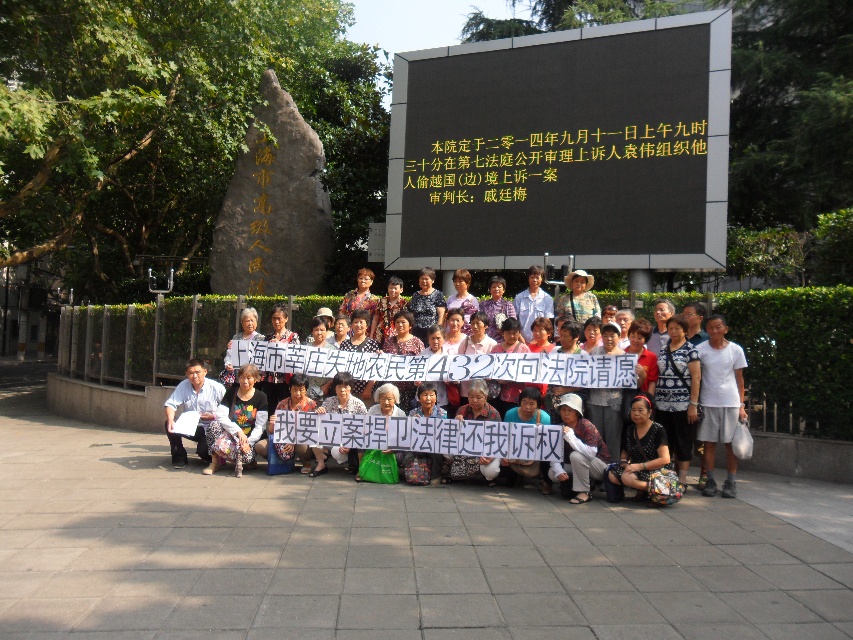
Question: Estimate the real-world distances between objects in this image. Which object is closer to the yellow text at upper center?

Choices:
 (A) white cotton shirt at center
 (B) black matte sign at upper center

Answer: (B)

Question: Can you confirm if black matte sign at upper center is wider than yellow text at upper center?

Choices:
 (A) no
 (B) yes

Answer: (B)

Question: Among these points, which one is nearest to the camera?

Choices:
 (A) (486, 163)
 (B) (553, 358)

Answer: (B)

Question: Which point is farther to the camera?

Choices:
 (A) white cotton shirt at center
 (B) yellow text at upper center
 (C) black matte sign at upper center

Answer: (B)

Question: Does black matte sign at upper center have a smaller size compared to yellow text at upper center?

Choices:
 (A) no
 (B) yes

Answer: (A)

Question: Can you confirm if black matte sign at upper center is positioned to the right of white cotton shirt at center?

Choices:
 (A) yes
 (B) no

Answer: (A)